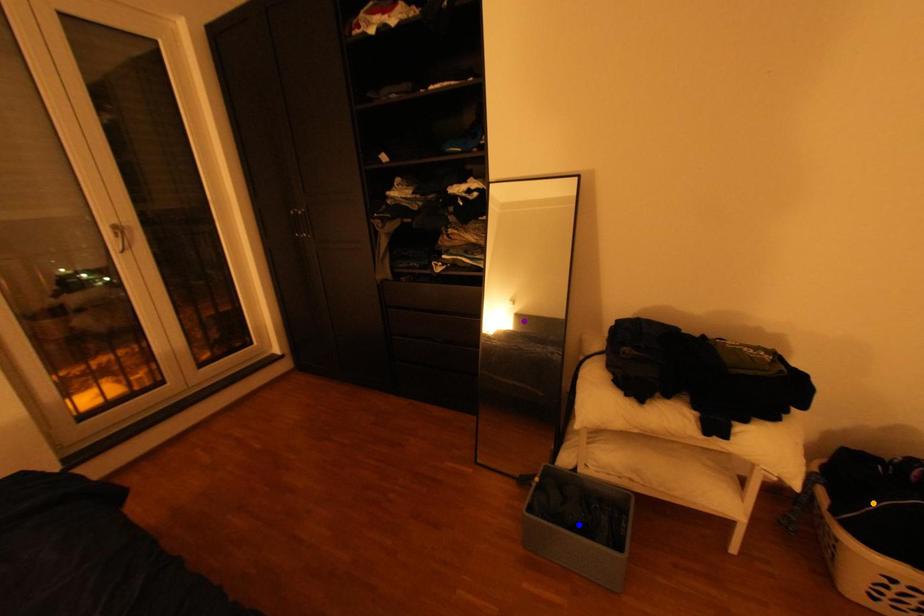
Order these from nearest to farthest:
A) blue point
B) purple point
C) orange point

orange point
blue point
purple point